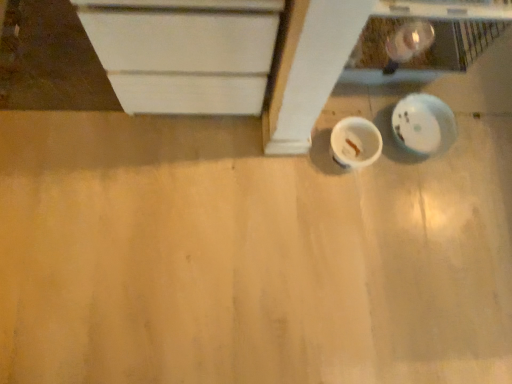
The width and height of the screenshot is (512, 384). I want to click on empty space that is ontop of matte white plywood at lower right, so click(x=220, y=195).